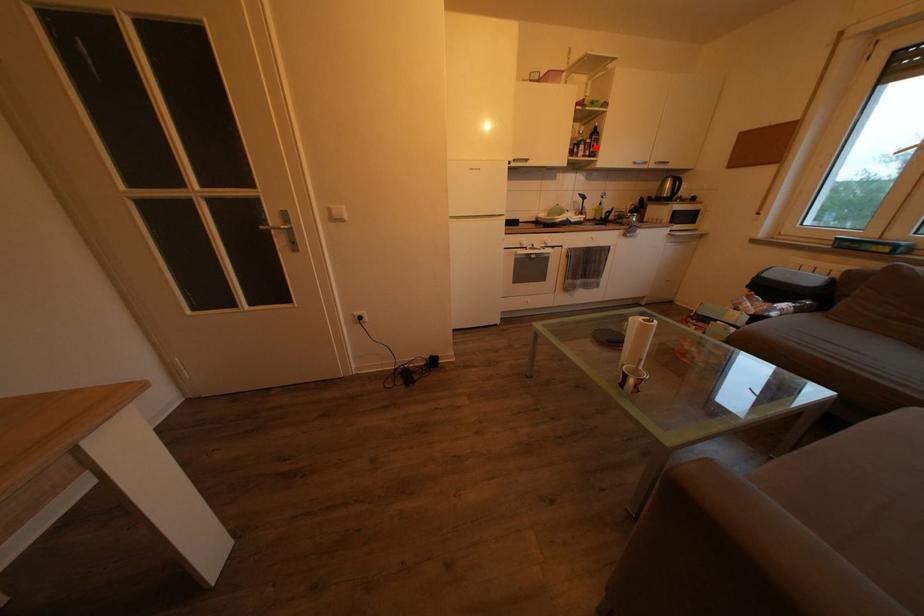
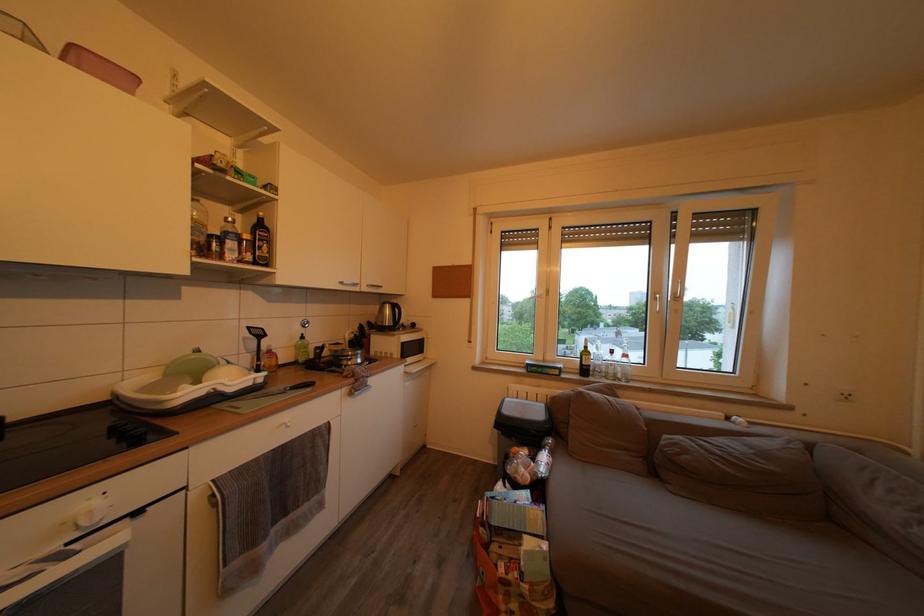
Question: I am providing you with two images of the same scene from different viewpoints. Image1 has a red point marked. In image2, the corresponding 3D location appears at what relative position? Reply with the corresponding letter.

Choices:
 (A) Closer
 (B) Farther

Answer: (B)